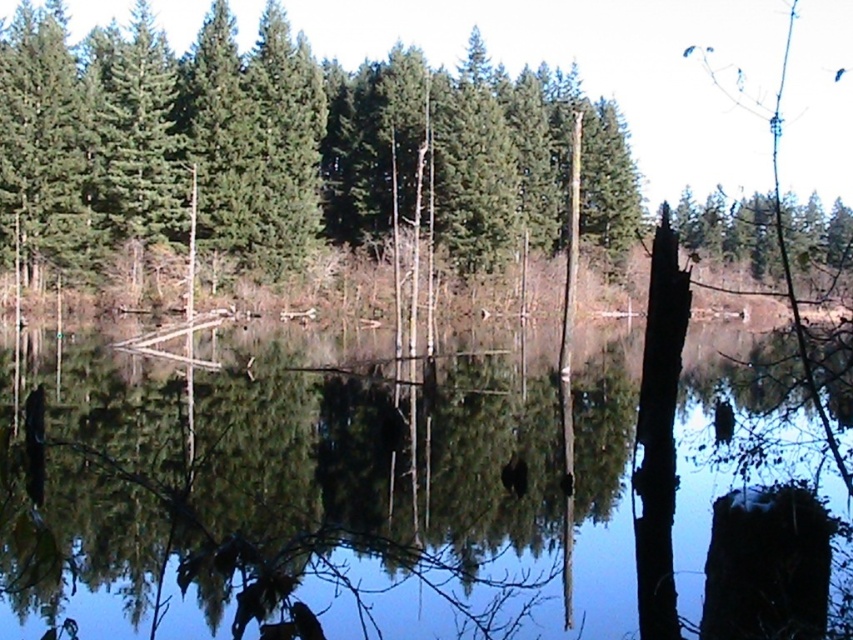
You are a bird flying over the serene natural scene. You see the transparent water at center and the green matte tree at upper center. Which object is positioned higher from your perspective?

The green matte tree at upper center is positioned higher than the transparent water at center from the bird perspective.